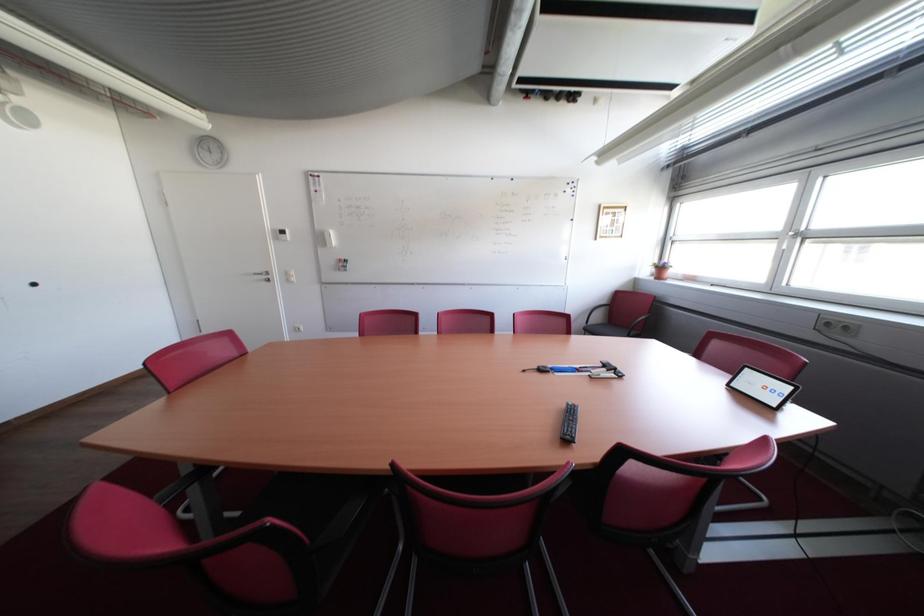
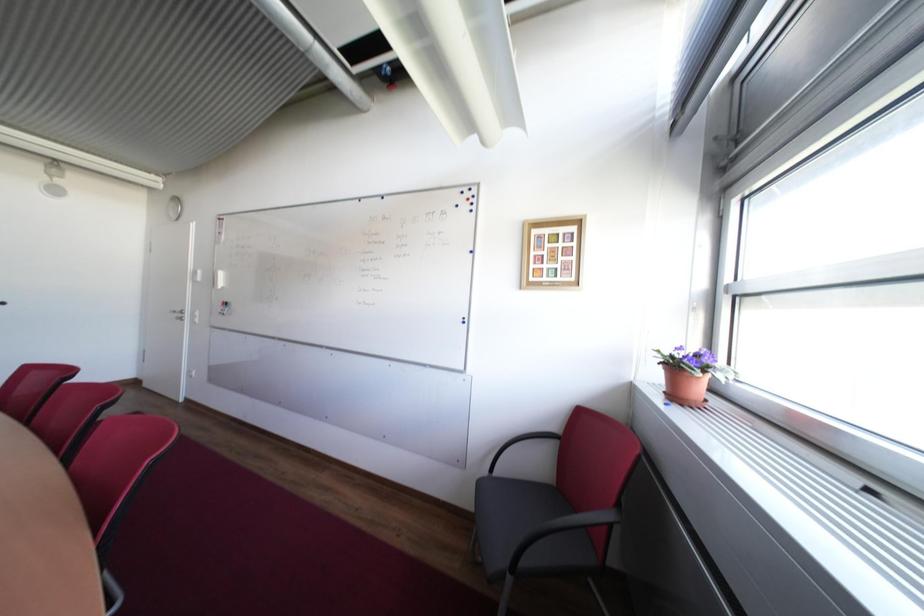
The images are taken continuously from a first-person perspective. In which direction are you moving?

The movement direction of the cameraman is right, forward.